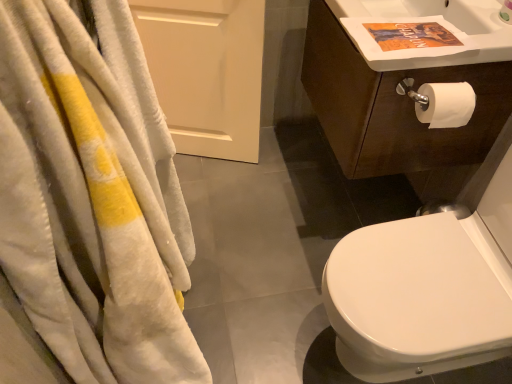
Question: Is white glossy bidet at right facing towards white soft towel at left?

Choices:
 (A) yes
 (B) no

Answer: (A)

Question: Is white glossy bidet at right surrounding white soft towel at left?

Choices:
 (A) yes
 (B) no

Answer: (B)

Question: Is white glossy bidet at right bigger than white soft towel at left?

Choices:
 (A) no
 (B) yes

Answer: (B)

Question: Is white glossy bidet at right further to camera compared to white soft towel at left?

Choices:
 (A) yes
 (B) no

Answer: (A)

Question: Is white soft towel at left at the back of white glossy bidet at right?

Choices:
 (A) yes
 (B) no

Answer: (B)

Question: Can you confirm if white glossy bidet at right is smaller than white soft towel at left?

Choices:
 (A) yes
 (B) no

Answer: (B)

Question: Is white glossy sink at upper right aimed at white glossy bidet at right?

Choices:
 (A) no
 (B) yes

Answer: (A)

Question: Is white glossy sink at upper right in contact with white glossy bidet at right?

Choices:
 (A) no
 (B) yes

Answer: (A)

Question: From a real-world perspective, is white glossy sink at upper right located higher than white glossy bidet at right?

Choices:
 (A) yes
 (B) no

Answer: (A)

Question: Does white glossy sink at upper right have a larger size compared to white glossy bidet at right?

Choices:
 (A) no
 (B) yes

Answer: (A)

Question: Can you confirm if white glossy sink at upper right is thinner than white glossy bidet at right?

Choices:
 (A) no
 (B) yes

Answer: (B)

Question: Is white glossy sink at upper right outside white glossy bidet at right?

Choices:
 (A) yes
 (B) no

Answer: (A)

Question: Does dark brown wood cabinet at upper right appear on the right side of white soft towel at left?

Choices:
 (A) no
 (B) yes

Answer: (B)